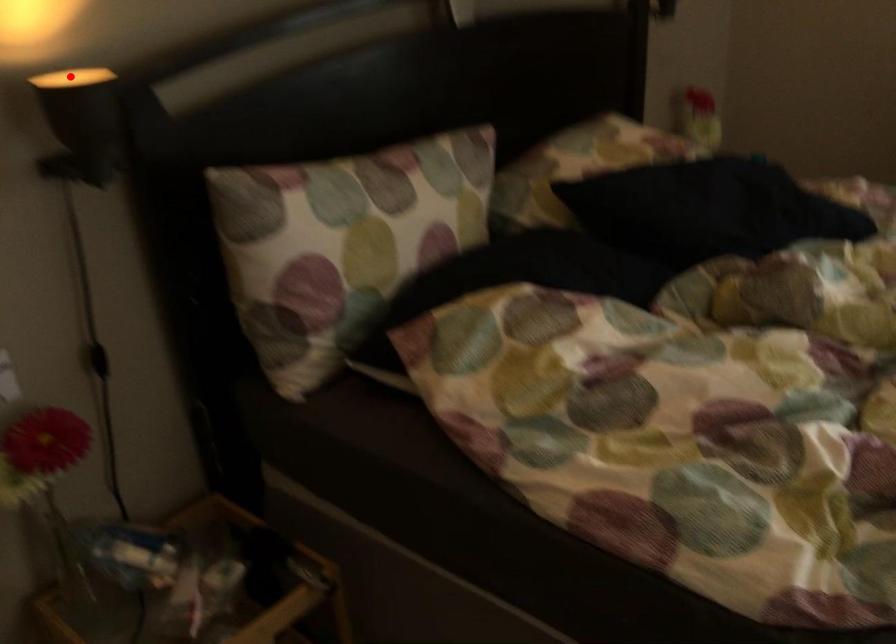
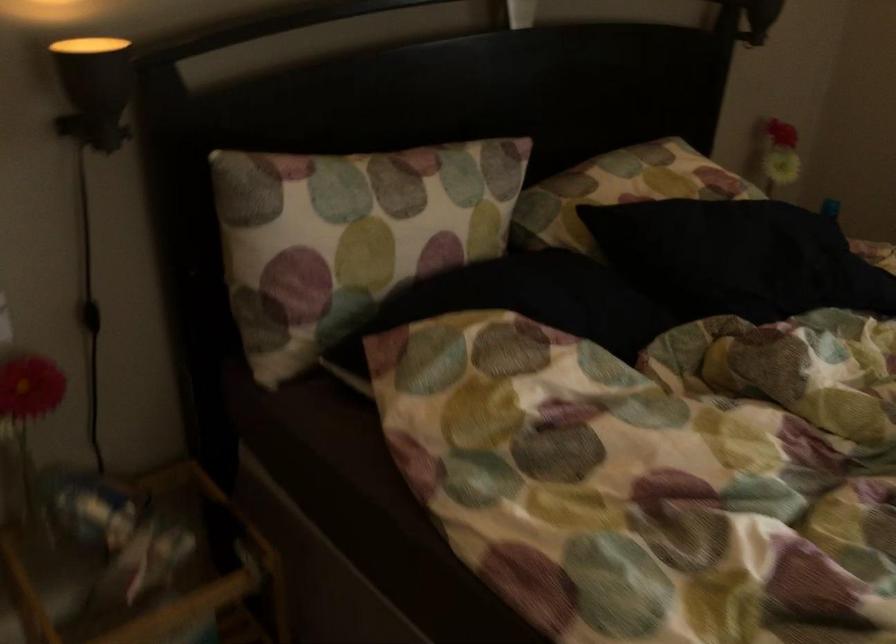
The point at the highlighted location is marked in the first image. Where is the corresponding point in the second image?

(90, 48)